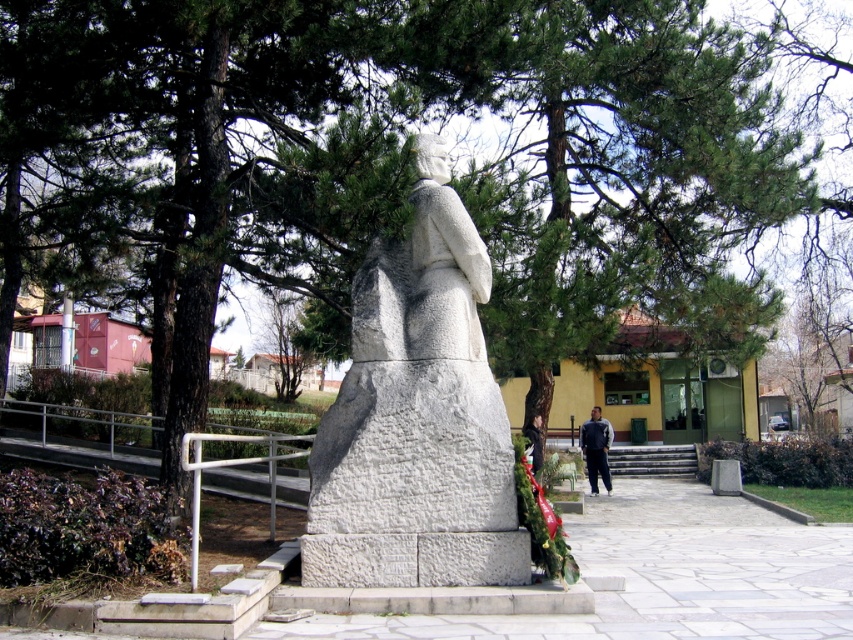
Is white stone statue at center positioned in front of dark gray fabric pants at lower center?

Yes.

Where is `white stone statue at center`? white stone statue at center is located at coordinates (416, 417).

This screenshot has height=640, width=853. In order to click on white stone statue at center in this screenshot , I will do `click(416, 417)`.